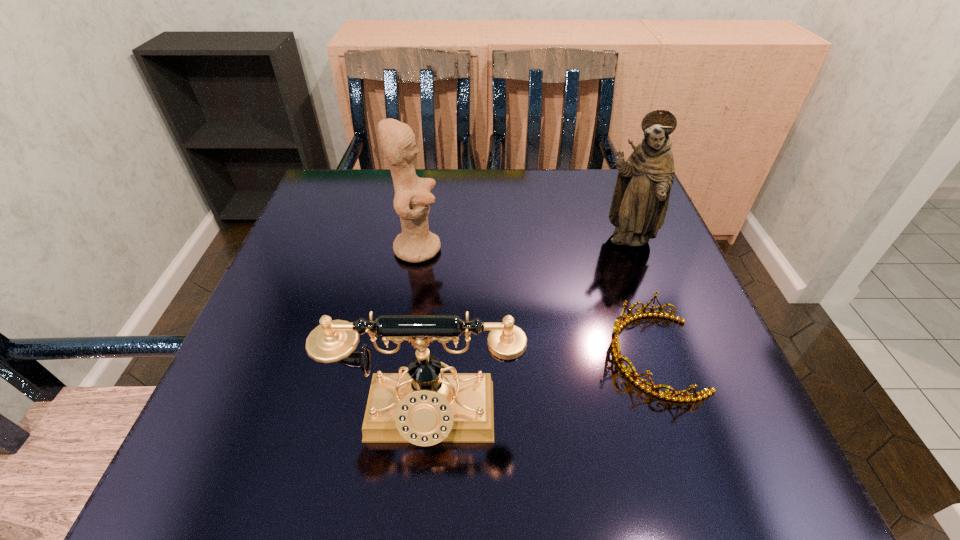
At what (x,y) coordinates should I click in order to perform the action: click on vacant area that lies between the shortest object and the second shortest object. Please return your answer as a coordinate pair (x, y). This screenshot has height=540, width=960. Looking at the image, I should click on (540, 386).

Locate an element on the screen. The height and width of the screenshot is (540, 960). empty space that is in between the right figurine and the tiara is located at coordinates (640, 298).

I want to click on vacant space that is in between the left figurine and the tiara, so click(x=536, y=302).

This screenshot has width=960, height=540. In order to click on unoccupied area between the telephone and the right figurine in this screenshot , I will do pos(527,329).

Locate an element on the screen. This screenshot has height=540, width=960. free space between the shortest object and the right figurine is located at coordinates (640, 298).

Locate an element on the screen. This screenshot has height=540, width=960. free space between the right figurine and the telephone is located at coordinates (527, 329).

I want to click on unoccupied position between the left figurine and the shortest object, so click(536, 302).

This screenshot has width=960, height=540. In order to click on free area in between the telephone and the right figurine in this screenshot , I will do `click(527, 329)`.

Locate an element on the screen. empty space between the telephone and the tiara is located at coordinates (540, 386).

Image resolution: width=960 pixels, height=540 pixels. Find the location of `object that is the second closest to the right figurine`. object that is the second closest to the right figurine is located at coordinates (412, 200).